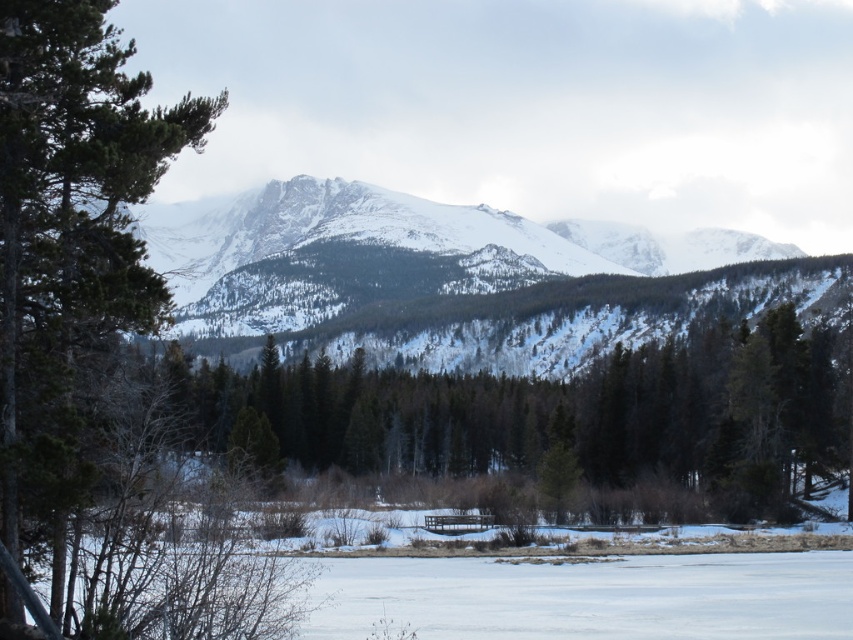
Does green textured pine tree at left have a smaller size compared to snowy rocky mountain at center?

Yes.

Looking at this image, is green textured pine tree at left positioned behind snowy rocky mountain at center?

No, green textured pine tree at left is closer to the viewer.

This screenshot has height=640, width=853. Identify the location of green textured pine tree at left. (70, 236).

Describe the element at coordinates (567, 413) in the screenshot. I see `green matte tree at center` at that location.

Is green matte tree at center shorter than snowy rocky mountain at center?

Yes.

Is point (235, 388) positioned in front of point (250, 189)?

Yes, it is.

Where is `green matte tree at center`? green matte tree at center is located at coordinates (567, 413).

Between green matte tree at center and green textured pine tree at left, which one has less height?

green matte tree at center

Can you confirm if green matte tree at center is smaller than green textured pine tree at left?

No, green matte tree at center is not smaller than green textured pine tree at left.

Which is in front, point (712, 380) or point (7, 230)?

Point (7, 230)

Locate an element on the screen. green matte tree at center is located at coordinates (567, 413).